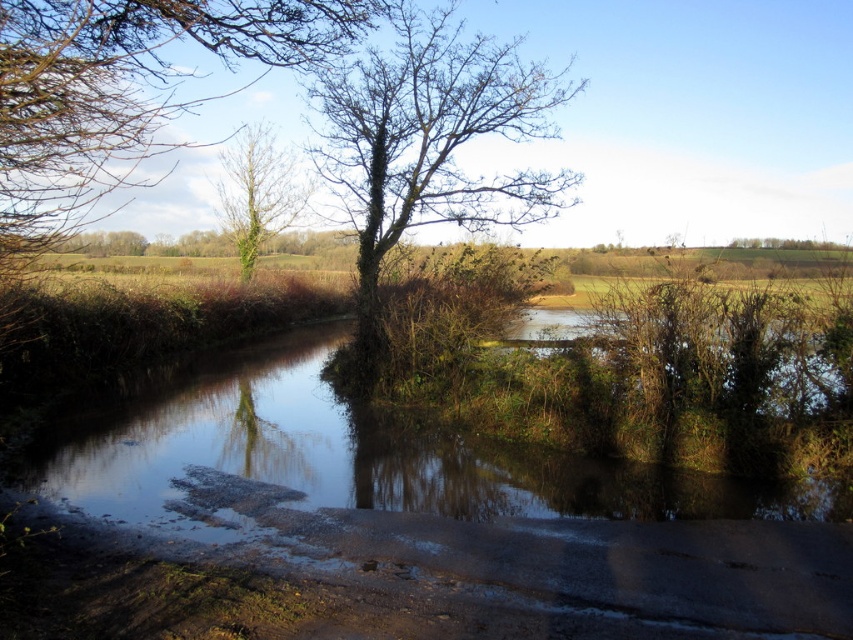
Question: Observing the image, what is the correct spatial positioning of bare branches at upper left in reference to green leafy tree at upper center?

Choices:
 (A) left
 (B) right

Answer: (B)

Question: Considering the relative positions of clear water at center and bare branches at upper left in the image provided, where is clear water at center located with respect to bare branches at upper left?

Choices:
 (A) right
 (B) left

Answer: (A)

Question: Which object is farther from the camera taking this photo?

Choices:
 (A) bare branches at center
 (B) bare branches at upper left
 (C) clear water at center

Answer: (A)

Question: Which object is farther from the camera taking this photo?

Choices:
 (A) clear water at center
 (B) bare branches at center

Answer: (B)

Question: Among these points, which one is farthest from the camera?

Choices:
 (A) (122, 96)
 (B) (370, 275)

Answer: (B)

Question: Is bare branches at upper left thinner than bare branches at center?

Choices:
 (A) yes
 (B) no

Answer: (B)